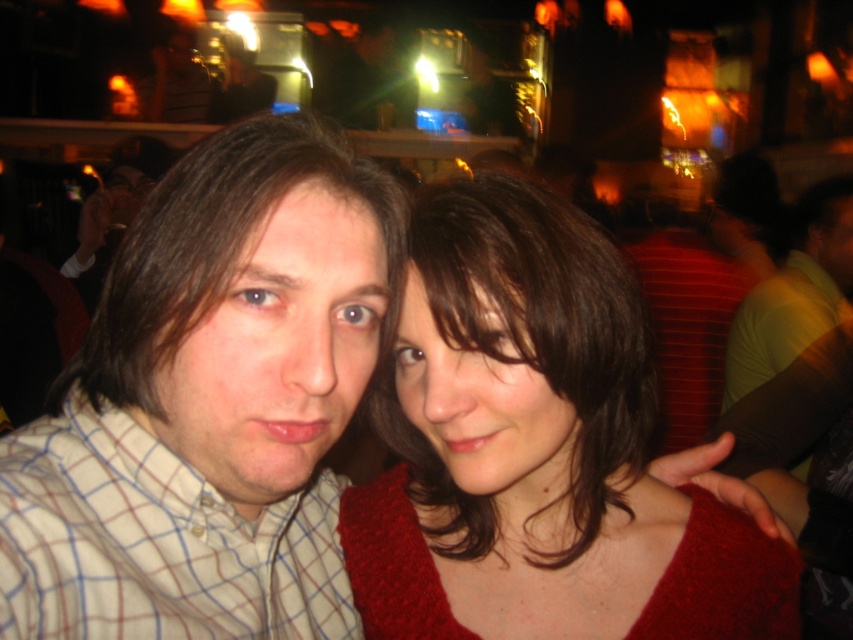
Measure the distance from matte red sweater at center to green matte shirt at right.

1.73 meters

Is point (558, 435) farther from camera compared to point (817, 225)?

That is False.

Is point (502, 536) farther from viewer compared to point (727, 392)?

No, (502, 536) is in front of (727, 392).

The width and height of the screenshot is (853, 640). I want to click on matte red sweater at center, so click(537, 451).

Is plaid shirt at center to the right of plaid cotton shirt at left from the viewer's perspective?

Indeed, plaid shirt at center is positioned on the right side of plaid cotton shirt at left.

What do you see at coordinates (210, 403) in the screenshot? I see `plaid shirt at center` at bounding box center [210, 403].

This screenshot has height=640, width=853. Identify the location of plaid shirt at center. (210, 403).

Is plaid shirt at center further to the viewer compared to green matte shirt at right?

No, it is in front of green matte shirt at right.

Can you confirm if plaid shirt at center is thinner than green matte shirt at right?

Correct, plaid shirt at center's width is less than green matte shirt at right's.

You are a GUI agent. You are given a task and a screenshot of the screen. Output one action in this format:
    pyautogui.click(x=<x>, y=<y>)
    Task: Click on the plaid shirt at center
    The height and width of the screenshot is (640, 853).
    Given the screenshot: What is the action you would take?
    pyautogui.click(x=210, y=403)

Find the location of a particular element. The image size is (853, 640). plaid shirt at center is located at coordinates (210, 403).